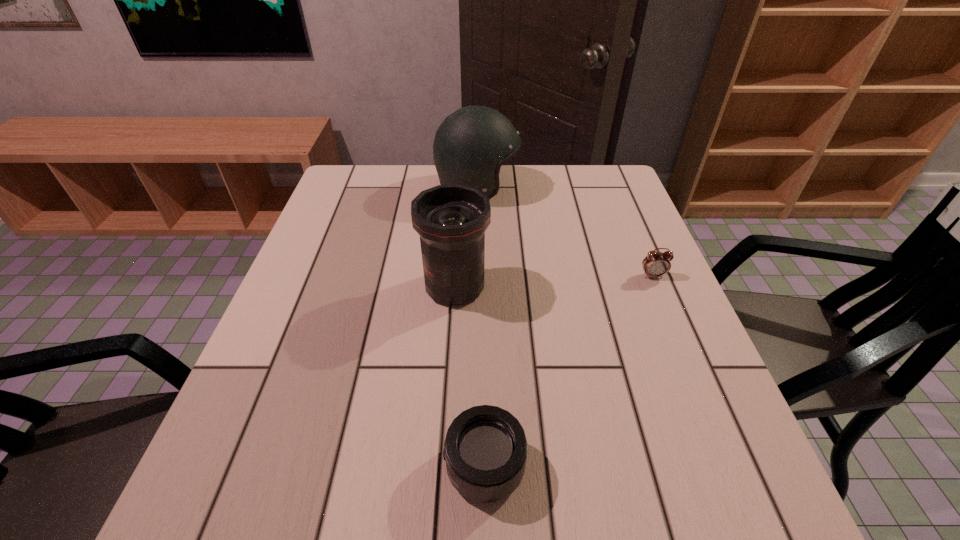
Identify which object is located as the second nearest to the alarm clock. Please provide its 2D coordinates. Your answer should be formatted as a tuple, i.e. [(x, y)], where the tuple contains the x and y coordinates of a point satisfying the conditions above.

[(470, 146)]

This screenshot has width=960, height=540. I want to click on object that is the closest to the nearest object, so click(x=451, y=220).

At what (x,y) coordinates should I click in order to perform the action: click on free region that satisfies the following two spatial constraints: 1. on the face of the rightmost object; 2. on the side of the shorter telephoto lens with brand markings and control switches. Please return your answer as a coordinate pair (x, y). Looking at the image, I should click on (732, 467).